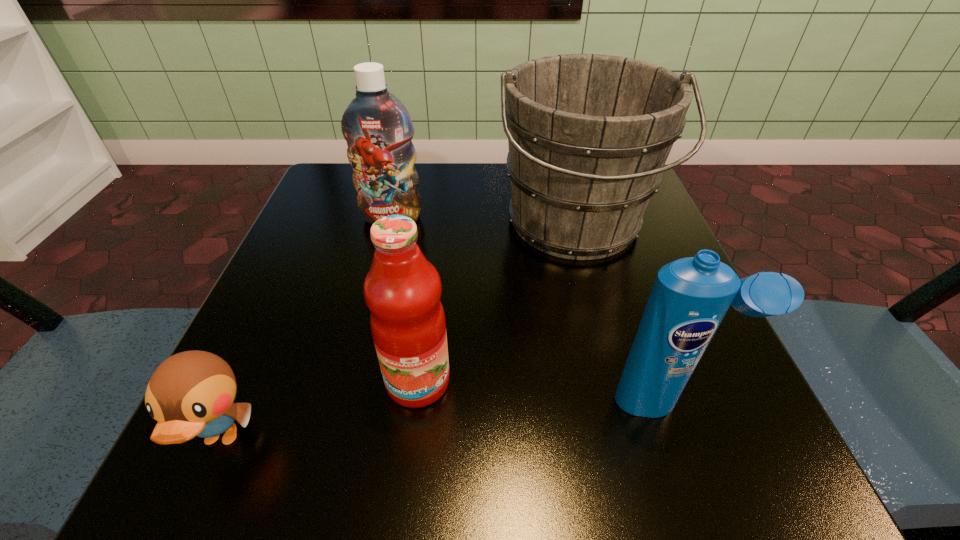
Find the location of `the left shampoo`. the left shampoo is located at coordinates (377, 127).

Locate an element on the screen. bucket is located at coordinates 588,134.

Find the location of a particular element. The image size is (960, 540). fruit juice is located at coordinates (402, 289).

At what (x,y) coordinates should I click in order to perform the action: click on the nearer shampoo. Please return your answer as a coordinate pair (x, y). The width and height of the screenshot is (960, 540). Looking at the image, I should click on (690, 297).

The image size is (960, 540). What are the coordinates of `the shorter shampoo` in the screenshot? It's located at (690, 297).

The image size is (960, 540). Identify the location of the leftmost object. (191, 393).

In order to click on duck in this screenshot , I will do `click(191, 393)`.

Where is `vacant space located 0.400m on the front label of the farther shampoo`? vacant space located 0.400m on the front label of the farther shampoo is located at coordinates (345, 407).

Where is `vacant space positioned 0.310m on the handle side of the bucket`? This screenshot has height=540, width=960. vacant space positioned 0.310m on the handle side of the bucket is located at coordinates (634, 453).

At what (x,y) coordinates should I click in order to perform the action: click on vacant space located on the front of the nearer shampoo. Please return your answer as a coordinate pair (x, y). Looking at the image, I should click on (691, 465).